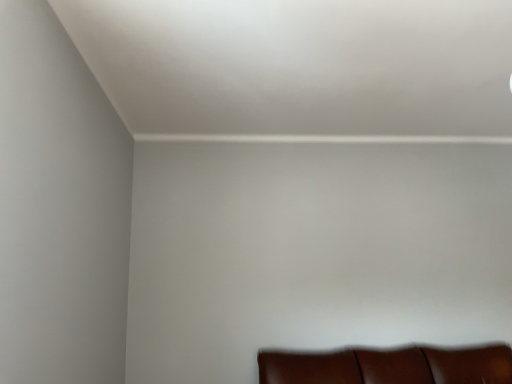
The image size is (512, 384). I want to click on brown leather couch at lower center, so [389, 366].

What is the approximate height of brown leather couch at lower center?

brown leather couch at lower center is 14.89 inches tall.

The height and width of the screenshot is (384, 512). What do you see at coordinates (389, 366) in the screenshot?
I see `brown leather couch at lower center` at bounding box center [389, 366].

Where is `brown leather couch at lower center`? Image resolution: width=512 pixels, height=384 pixels. brown leather couch at lower center is located at coordinates (389, 366).